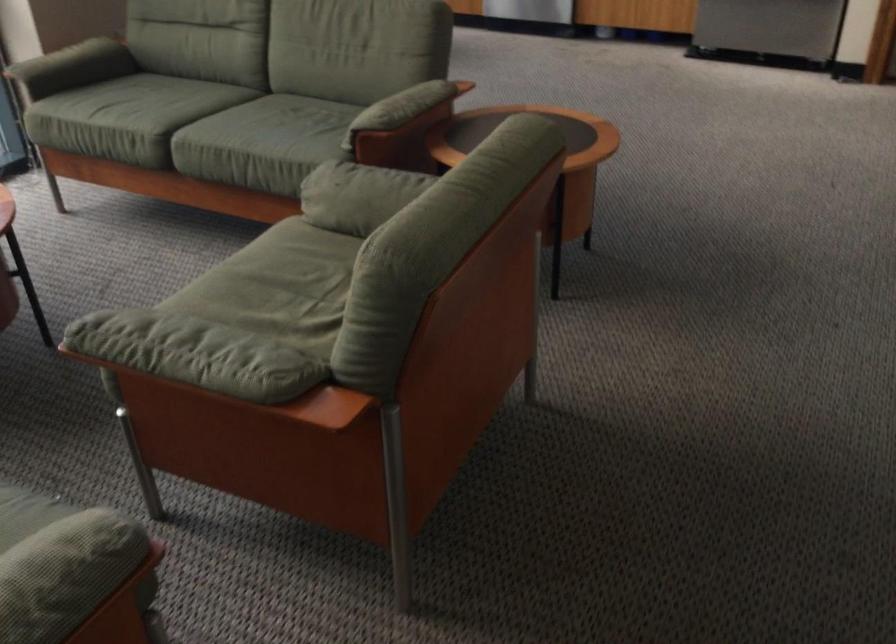
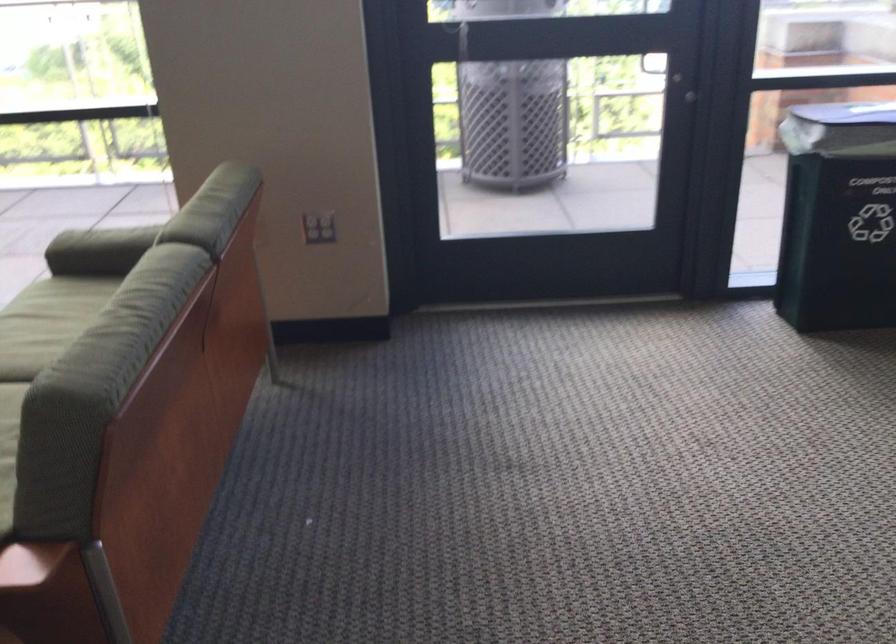
The point at (138, 118) is marked in the first image. Where is the corresponding point in the second image?

(46, 323)